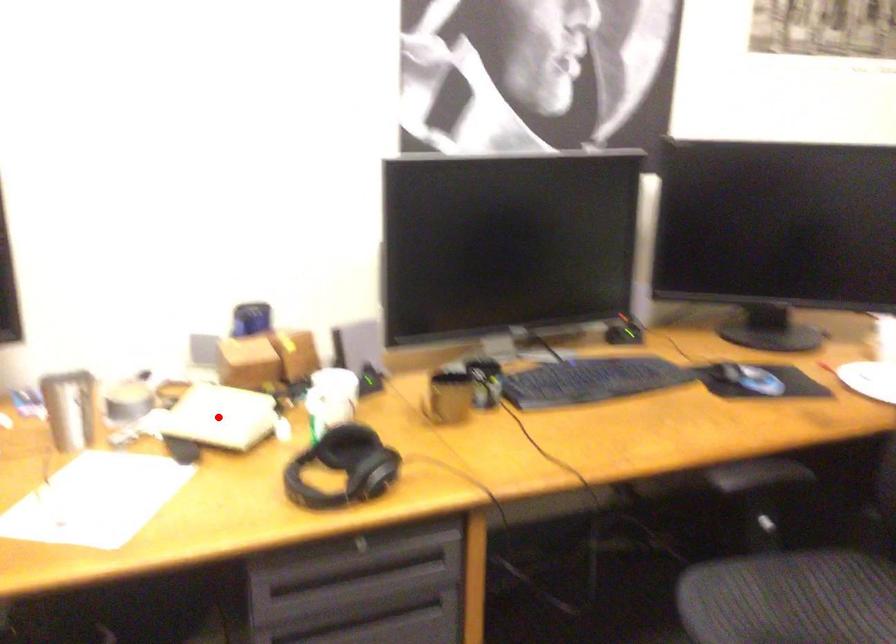
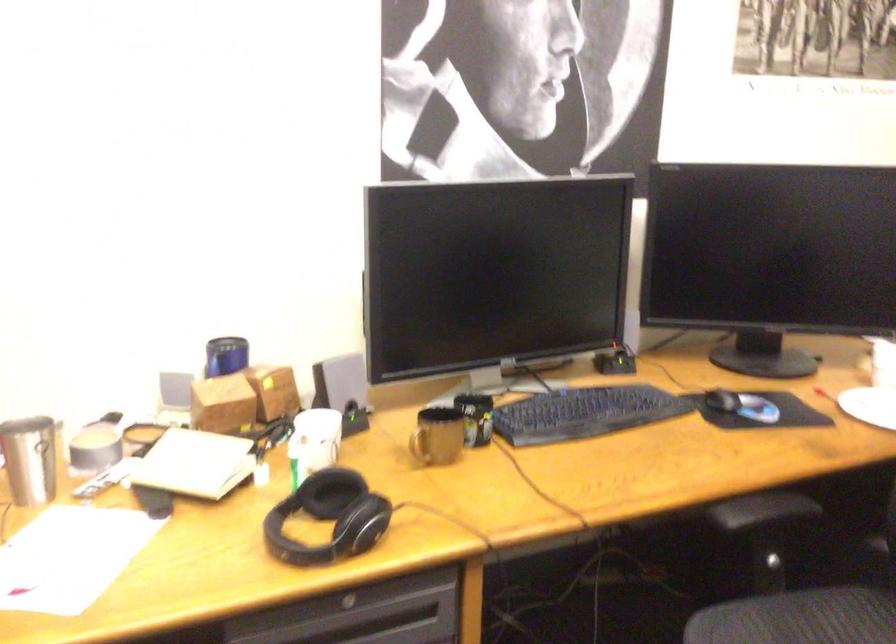
Where in the second image is the point corresponding to the highlighted location from the first image?

(194, 464)